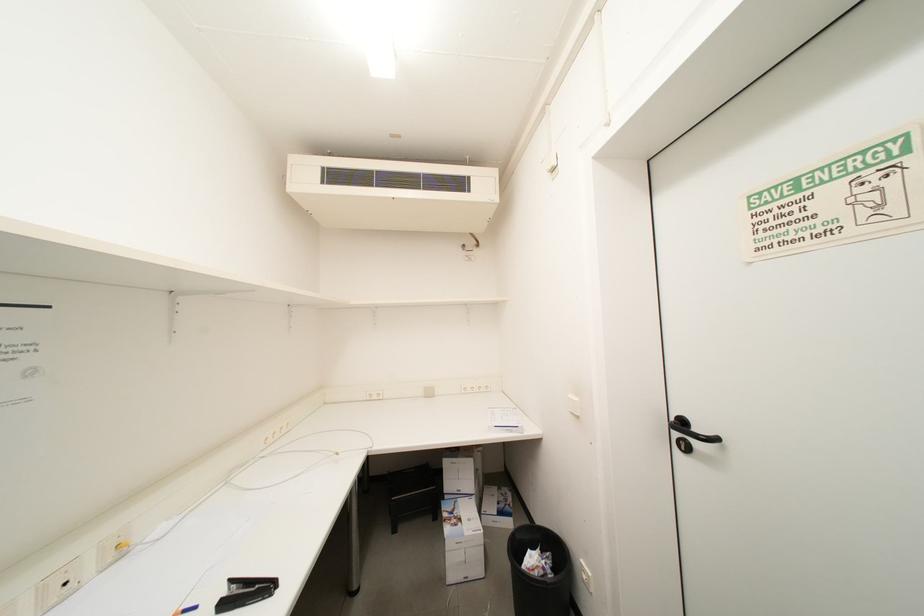
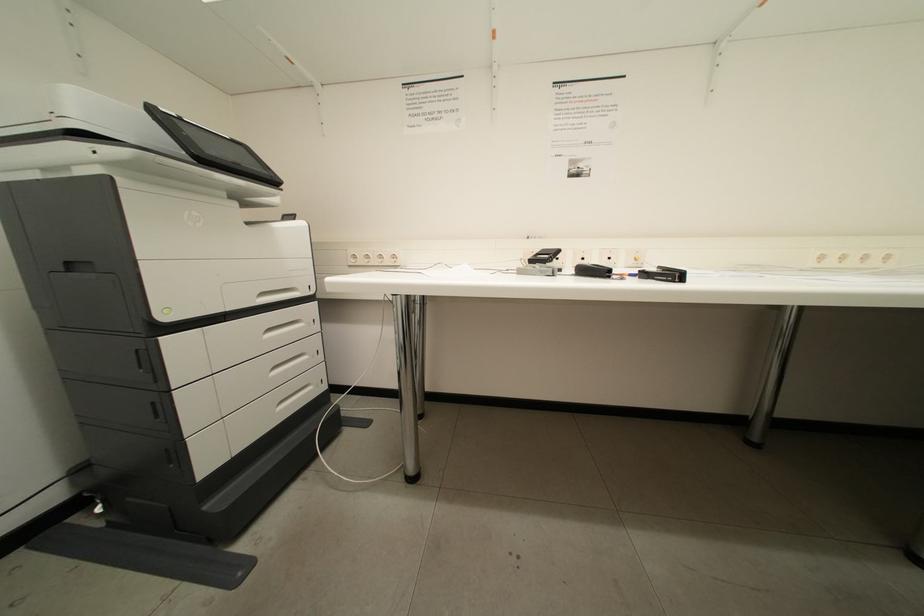
Question: Based on the continuous images, in which direction is the camera rotating? Reply with the corresponding letter.

Choices:
 (A) Left
 (B) Right
 (C) Up
 (D) Down

Answer: (A)